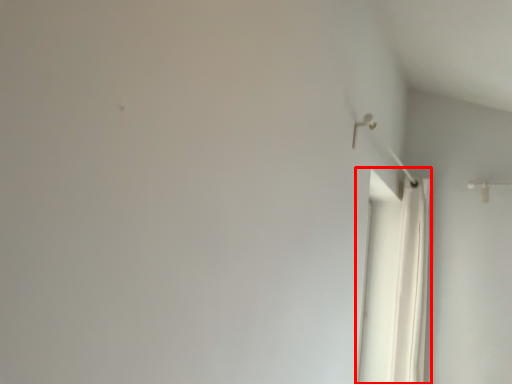
Question: Considering the relative positions of shower curtain (annotated by the red box) and shower in the image provided, where is shower curtain (annotated by the red box) located with respect to the staircase?

Choices:
 (A) right
 (B) left

Answer: (A)